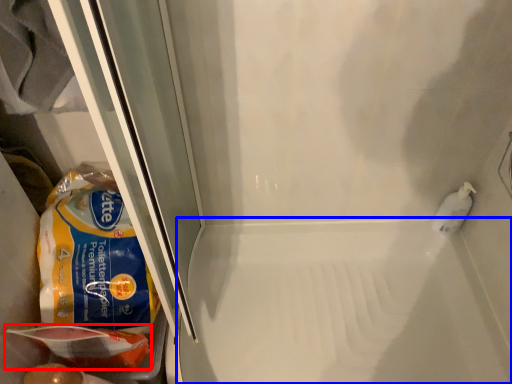
Question: Among these objects, which one is farthest to the camera, food (highlighted by a red box) or bath (highlighted by a blue box)?

Choices:
 (A) food
 (B) bath

Answer: (B)